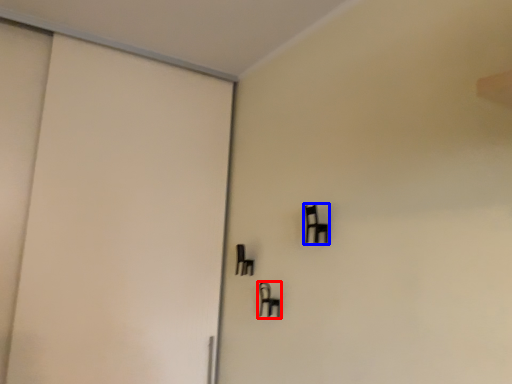
Question: Which of the following is the farthest to the observer, furniture (highlighted by a red box) or furniture (highlighted by a blue box)?

Choices:
 (A) furniture
 (B) furniture

Answer: (A)